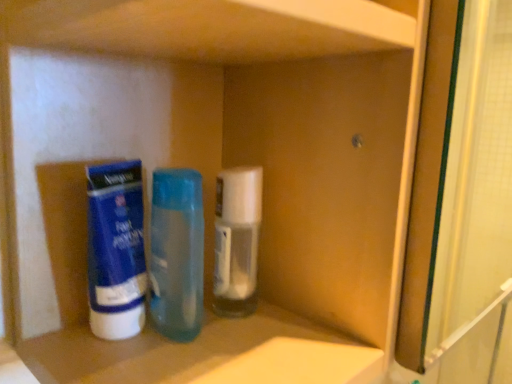
Question: From a real-world perspective, is translucent plastic bottle at center, positioned as the 1th bottle in left-to-right order, positioned under blue matte tube at left based on gravity?

Choices:
 (A) no
 (B) yes

Answer: (A)

Question: Is translucent plastic bottle at center, positioned as the 1th bottle in left-to-right order, far from blue matte tube at left?

Choices:
 (A) yes
 (B) no

Answer: (B)

Question: Is translucent plastic bottle at center, the 2th bottle viewed from the right, completely or partially outside of blue matte tube at left?

Choices:
 (A) no
 (B) yes

Answer: (B)

Question: Is translucent plastic bottle at center, positioned as the 1th bottle in left-to-right order, taller than blue matte tube at left?

Choices:
 (A) yes
 (B) no

Answer: (A)

Question: Is translucent plastic bottle at center, positioned as the 1th bottle in left-to-right order, looking in the opposite direction of blue matte tube at left?

Choices:
 (A) yes
 (B) no

Answer: (A)

Question: From the image's perspective, relative to white plastic container at center, acting as the first bottle starting from the right, is translucent plastic bottle at center, the 2th bottle viewed from the right, above or below?

Choices:
 (A) above
 (B) below

Answer: (B)

Question: In terms of width, does translucent plastic bottle at center, positioned as the 1th bottle in left-to-right order, look wider or thinner when compared to white plastic container at center, acting as the first bottle starting from the right?

Choices:
 (A) wide
 (B) thin

Answer: (A)

Question: In terms of height, does translucent plastic bottle at center, the 2th bottle viewed from the right, look taller or shorter compared to white plastic container at center, the second bottle from the left?

Choices:
 (A) short
 (B) tall

Answer: (B)

Question: Looking at the image, does translucent plastic bottle at center, positioned as the 1th bottle in left-to-right order, seem bigger or smaller compared to white plastic container at center, the second bottle from the left?

Choices:
 (A) small
 (B) big

Answer: (B)

Question: Is blue matte tube at left taller or shorter than white plastic container at center, the second bottle from the left?

Choices:
 (A) tall
 (B) short

Answer: (A)

Question: Is point (123, 241) positioned closer to the camera than point (225, 228)?

Choices:
 (A) closer
 (B) farther

Answer: (A)

Question: Considering their positions, is blue matte tube at left located in front of or behind white plastic container at center, the second bottle from the left?

Choices:
 (A) behind
 (B) front

Answer: (B)

Question: Based on their sizes in the image, would you say blue matte tube at left is bigger or smaller than white plastic container at center, the second bottle from the left?

Choices:
 (A) small
 (B) big

Answer: (B)

Question: Considering the relative positions of translucent plastic bottle at center, positioned as the 1th bottle in left-to-right order, and blue matte tube at left in the image provided, is translucent plastic bottle at center, positioned as the 1th bottle in left-to-right order, to the left or to the right of blue matte tube at left?

Choices:
 (A) left
 (B) right

Answer: (B)

Question: In terms of height, does translucent plastic bottle at center, the 2th bottle viewed from the right, look taller or shorter compared to blue matte tube at left?

Choices:
 (A) short
 (B) tall

Answer: (B)